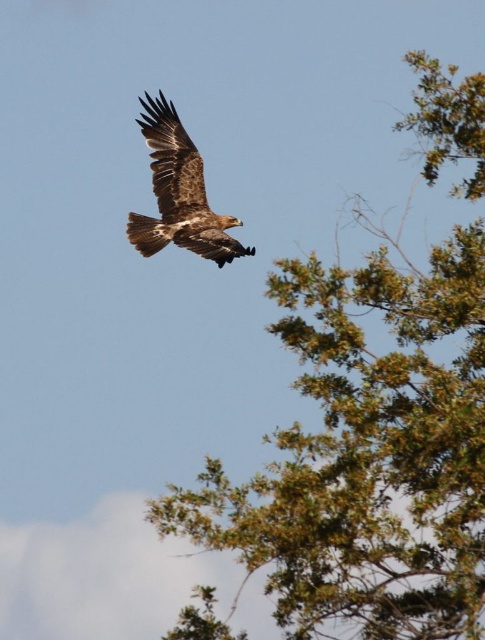
Based on the photo, who is more forward, (425,483) or (151,106)?

Point (425,483) is more forward.

Can you confirm if green leafy tree at upper right is positioned to the left of brown feathered eagle at upper center?

Incorrect, green leafy tree at upper right is not on the left side of brown feathered eagle at upper center.

Does point (279, 540) lie in front of point (167, 132)?

Yes, point (279, 540) is in front of point (167, 132).

You are a GUI agent. You are given a task and a screenshot of the screen. Output one action in this format:
    pyautogui.click(x=<x>, y=<y>)
    Task: Click on the green leafy tree at upper right
    Image resolution: width=485 pixels, height=640 pixels.
    Given the screenshot: What is the action you would take?
    pyautogui.click(x=368, y=456)